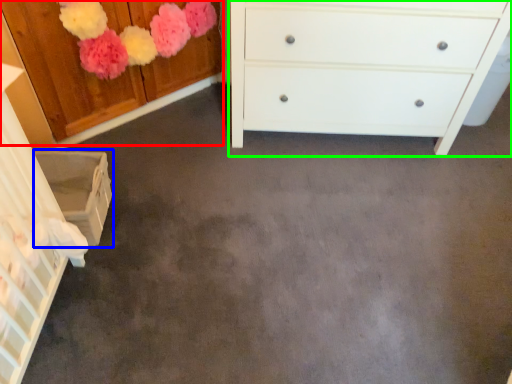
Question: Based on their relative distances, which object is nearer to cabinetry (highlighted by a red box)? Choose from cabinetry (highlighted by a blue box) and chest of drawers (highlighted by a green box).

Choices:
 (A) cabinetry
 (B) chest of drawers

Answer: (A)